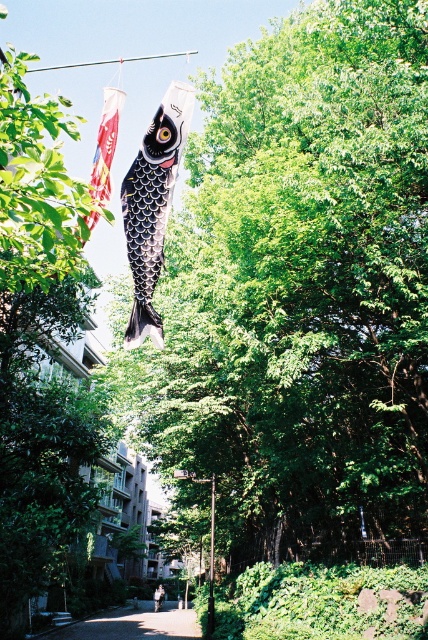
Can you confirm if green leafy tree at center is positioned to the left of green leafy tree at upper center?

No, green leafy tree at center is not to the left of green leafy tree at upper center.

Is green leafy tree at center bigger than green leafy tree at upper center?

Actually, green leafy tree at center might be smaller than green leafy tree at upper center.

What do you see at coordinates (300, 292) in the screenshot? I see `green leafy tree at center` at bounding box center [300, 292].

At what (x,y) coordinates should I click in order to perform the action: click on green leafy tree at center. Please return your answer as a coordinate pair (x, y). This screenshot has width=428, height=640. Looking at the image, I should click on (300, 292).

Measure the distance from green leafy tree at center to black glossy fish at center.

green leafy tree at center is 10.63 meters away from black glossy fish at center.

Find the location of `green leafy tree at center`. green leafy tree at center is located at coordinates (300, 292).

Between point (360, 116) and point (124, 337), which one is positioned in front?

Point (360, 116)

This screenshot has width=428, height=640. Find the location of `green leafy tree at center`. green leafy tree at center is located at coordinates (300, 292).

Is black glossy fish at center below smooth concrete path at center?

Incorrect, black glossy fish at center is not positioned below smooth concrete path at center.

Which is in front, point (136, 230) or point (146, 620)?

Point (136, 230) is more forward.

Between point (160, 225) and point (82, 624), which one is positioned behind?

Positioned behind is point (82, 624).

Image resolution: width=428 pixels, height=640 pixels. I want to click on black glossy fish at center, so click(x=152, y=205).